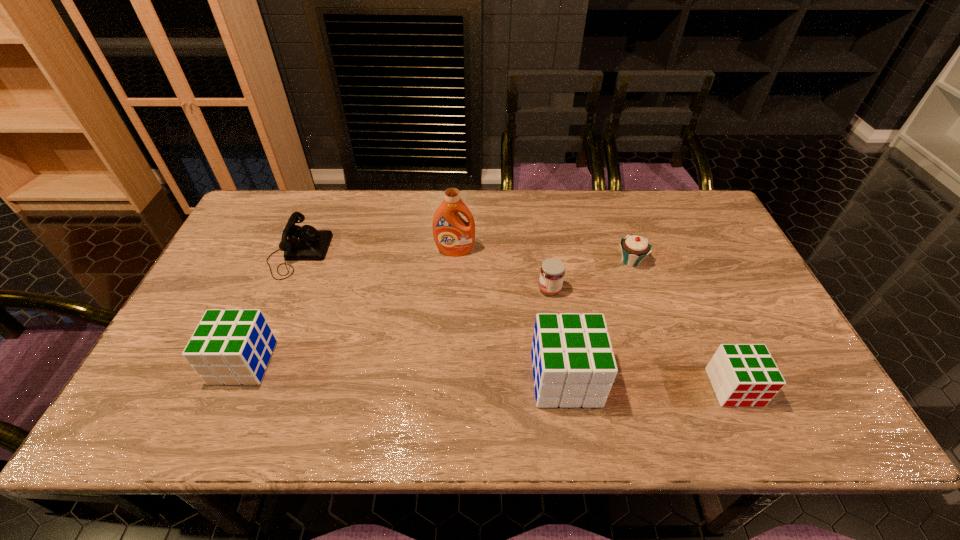
The image size is (960, 540). Identify the location of cube located in the left edge section of the desktop. (233, 346).

Locate an element on the screen. telephone located in the left edge section of the desktop is located at coordinates (305, 243).

I want to click on object positioned at the right edge, so click(x=742, y=375).

Locate an element on the screen. The height and width of the screenshot is (540, 960). object present at the far left corner is located at coordinates (305, 243).

Identify the location of object at the near left corner. This screenshot has width=960, height=540. (233, 346).

This screenshot has height=540, width=960. Find the location of `object present at the near right corner`. object present at the near right corner is located at coordinates (742, 375).

The image size is (960, 540). In the image, there is a desktop. Find the location of `vacant space at the far edge`. vacant space at the far edge is located at coordinates (584, 234).

The image size is (960, 540). I want to click on blank space at the near edge of the desktop, so click(x=684, y=379).

This screenshot has height=540, width=960. I want to click on free point at the right edge, so click(709, 306).

Identify the location of vacant space at the far left corner of the desktop. The image size is (960, 540). (248, 229).